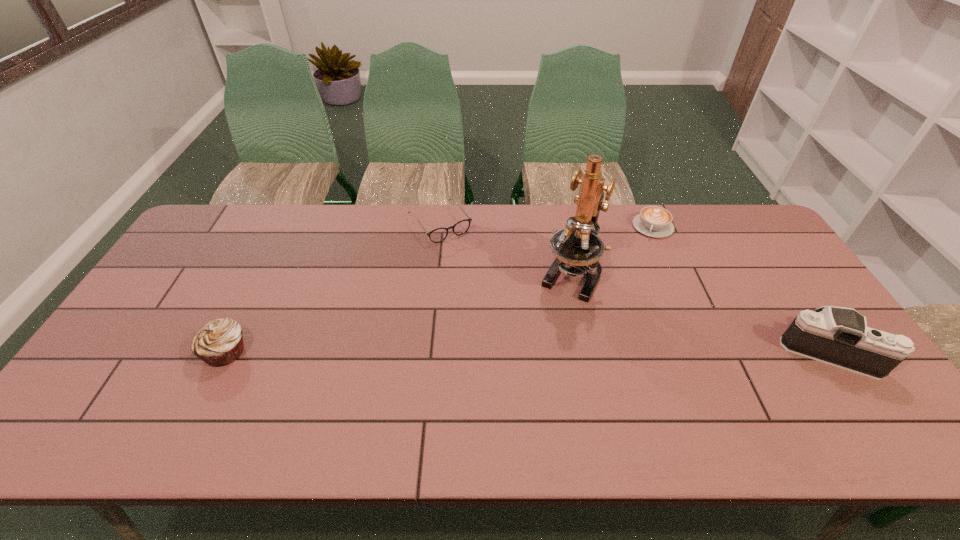
The image size is (960, 540). In the image, there is a desktop. Find the location of `vacant space at the far right corner`. vacant space at the far right corner is located at coordinates (725, 245).

I want to click on free spot between the cappuccino and the third object from left to right, so click(x=612, y=250).

Where is `vacant area that lies between the leftmost object and the camera`? This screenshot has height=540, width=960. vacant area that lies between the leftmost object and the camera is located at coordinates (526, 351).

Locate an element on the screen. The image size is (960, 540). vacant region between the third object from right to left and the muffin is located at coordinates (397, 312).

This screenshot has width=960, height=540. Identify the location of free spot between the camera and the fourth object from right to left. point(633,287).

The height and width of the screenshot is (540, 960). Find the location of `blank region between the fourth shortest object and the cappuccino`. blank region between the fourth shortest object and the cappuccino is located at coordinates (739, 289).

Where is `vacant space that's between the fourth object from right to left and the third object from right to left`? This screenshot has width=960, height=540. vacant space that's between the fourth object from right to left and the third object from right to left is located at coordinates (505, 248).

This screenshot has width=960, height=540. In order to click on empty location between the fourth object from right to left and the third shortest object in this screenshot , I will do `click(332, 288)`.

In order to click on free space between the rightmost object and the cappuccino in this screenshot , I will do `click(739, 289)`.

You are a GUI agent. You are given a task and a screenshot of the screen. Output one action in this format:
    pyautogui.click(x=<x>, y=<y>)
    Task: Click on the free spot between the spectacles and the camera
    The height and width of the screenshot is (540, 960).
    Given the screenshot: What is the action you would take?
    pyautogui.click(x=633, y=287)